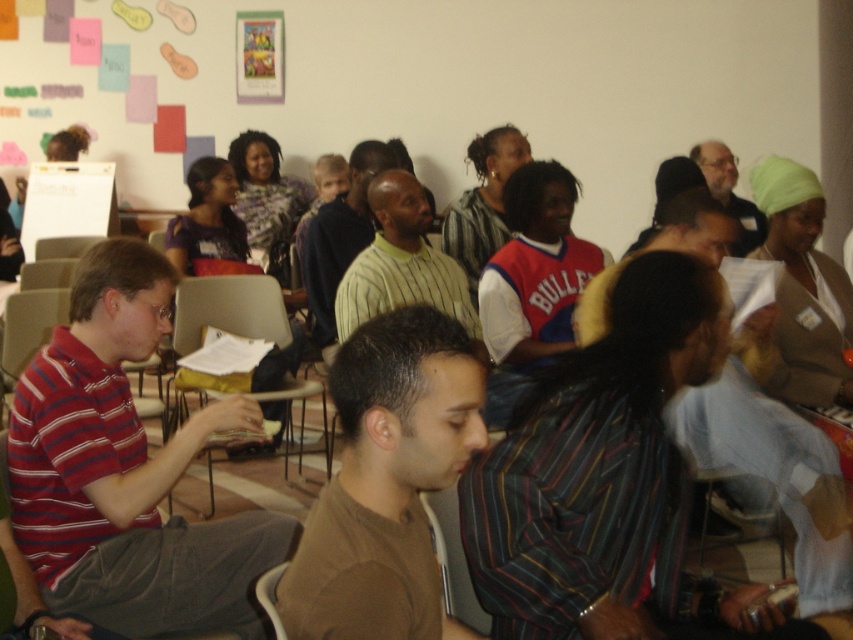
You are sitting in the wooden chair at lower center in the classroom. You want to hand a note to the person wearing the brown cotton shirt at center. In which direction should you move to reach them?

The brown cotton shirt at center is to the right of the wooden chair at lower center, so you should move to your right to reach them.

You are a photographer standing at the back of the room. You want to take a photo of the yellow striped shirt at center and the wooden chair at lower center. Which object will appear larger in your photo?

The yellow striped shirt at center will appear larger in the photo because it is taller than the wooden chair at lower center.

You are a photographer who needs to capture a clear shot of both the striped cotton shirt at left and the matte black shirt at upper right. However, you can only position your camera in a way that focuses on one of them. Which shirt should you focus on to ensure the other is still visible in the background?

You should focus on the striped cotton shirt at left because it is in front of the matte black shirt at upper right, meaning the matte black shirt at upper right will be visible behind it in the background.